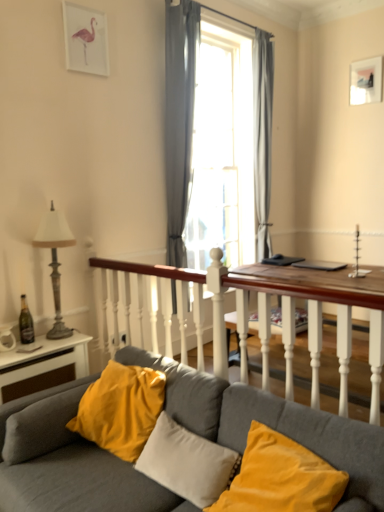
Question: From a real-world perspective, is gray fabric curtain at right, which is counted as the 1th curtain, starting from the back, positioned under transparent glass window at center based on gravity?

Choices:
 (A) yes
 (B) no

Answer: (B)

Question: From the image's perspective, does gray fabric curtain at right, which is the 2th curtain in front-to-back order, appear lower than transparent glass window at center?

Choices:
 (A) no
 (B) yes

Answer: (A)

Question: Does gray fabric curtain at right, which appears as the first curtain when viewed from the right, have a smaller size compared to transparent glass window at center?

Choices:
 (A) no
 (B) yes

Answer: (B)

Question: Does gray fabric curtain at right, which appears as the second curtain when viewed from the left, lie in front of transparent glass window at center?

Choices:
 (A) no
 (B) yes

Answer: (A)

Question: Does gray fabric curtain at right, which appears as the first curtain when viewed from the right, appear on the left side of transparent glass window at center?

Choices:
 (A) yes
 (B) no

Answer: (B)

Question: Does gray fabric curtain at right, which appears as the first curtain when viewed from the right, appear on the right side of transparent glass window at center?

Choices:
 (A) yes
 (B) no

Answer: (A)

Question: From a real-world perspective, does velvet gray couch at lower left sit lower than gray fabric curtain at right, which is the 2th curtain in front-to-back order?

Choices:
 (A) no
 (B) yes

Answer: (B)

Question: From the image's perspective, does velvet gray couch at lower left appear lower than gray fabric curtain at right, which is the 2th curtain in front-to-back order?

Choices:
 (A) yes
 (B) no

Answer: (A)

Question: From the image's perspective, is velvet gray couch at lower left located above gray fabric curtain at right, which appears as the first curtain when viewed from the right?

Choices:
 (A) yes
 (B) no

Answer: (B)

Question: Does velvet gray couch at lower left have a lesser height compared to gray fabric curtain at right, which is counted as the 1th curtain, starting from the back?

Choices:
 (A) yes
 (B) no

Answer: (A)

Question: From a real-world perspective, is velvet gray couch at lower left over gray fabric curtain at right, which appears as the first curtain when viewed from the right?

Choices:
 (A) no
 (B) yes

Answer: (A)

Question: Is velvet gray couch at lower left oriented towards gray fabric curtain at right, which is counted as the 1th curtain, starting from the back?

Choices:
 (A) yes
 (B) no

Answer: (B)

Question: Does velvet yellow pillow at center, which is the 1th pillow from left to right, touch gray sheer curtain at center, which is the 1th curtain from front to back?

Choices:
 (A) no
 (B) yes

Answer: (A)